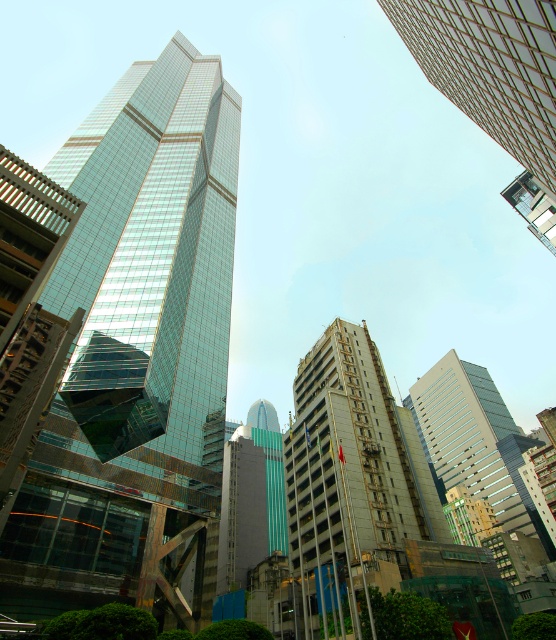
Question: Considering the relative positions of transparent glass skyscraper at center and glassy reflective skyscraper at upper right in the image provided, where is transparent glass skyscraper at center located with respect to glassy reflective skyscraper at upper right?

Choices:
 (A) above
 (B) below

Answer: (A)

Question: In this image, where is transparent glass skyscraper at center located relative to beige concrete building at center?

Choices:
 (A) below
 (B) above

Answer: (B)

Question: Among these points, which one is farthest from the camera?

Choices:
 (A) (305, 509)
 (B) (478, 476)
 (C) (224, 401)
 (D) (428, 52)

Answer: (B)

Question: Which object is positioned farthest from the matte glass building at center?

Choices:
 (A) glassy reflective skyscraper at upper right
 (B) transparent glass skyscraper at center
 (C) beige concrete building at center

Answer: (B)

Question: Can you confirm if beige concrete building at center is positioned below glassy reflective skyscraper at upper right?

Choices:
 (A) yes
 (B) no

Answer: (A)

Question: Which is farther from the beige concrete building at center?

Choices:
 (A) glassy reflective skyscraper at upper right
 (B) transparent glass skyscraper at center

Answer: (A)